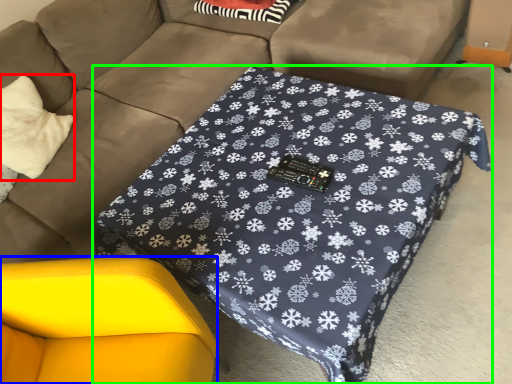
Question: Based on their relative distances, which object is farther from throw pillow (highlighted by a red box)? Choose from swivel chair (highlighted by a blue box) and table (highlighted by a green box).

Choices:
 (A) swivel chair
 (B) table

Answer: (B)